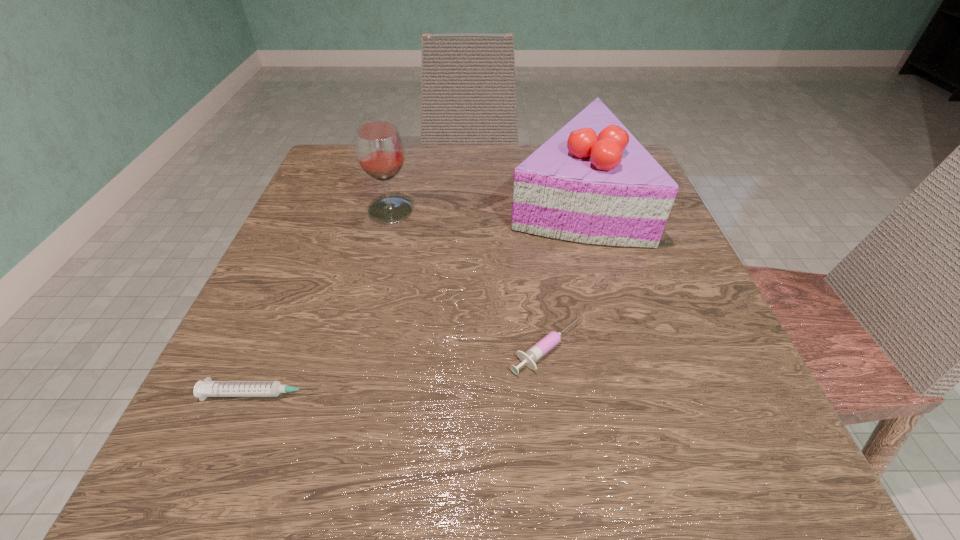
Locate an element on the screen. The width and height of the screenshot is (960, 540). cake is located at coordinates (592, 182).

At what (x,y) coordinates should I click in order to perform the action: click on wineglass. Please return your answer as a coordinate pair (x, y). Looking at the image, I should click on (379, 148).

Locate an element on the screen. the left syringe is located at coordinates (207, 388).

This screenshot has width=960, height=540. In order to click on the nearest object in this screenshot , I will do `click(207, 388)`.

Locate an element on the screen. the second nearest object is located at coordinates (528, 358).

At what (x,y) coordinates should I click in order to perform the action: click on the farther syringe. Please return your answer as a coordinate pair (x, y). Looking at the image, I should click on (528, 358).

Where is `free location located on the front of the cake`? The height and width of the screenshot is (540, 960). free location located on the front of the cake is located at coordinates (605, 326).

Find the location of a particular element. This screenshot has height=540, width=960. free spot located on the front of the wineglass is located at coordinates (363, 323).

Where is `vacant space positioned at the needle end of the left syringe`? The height and width of the screenshot is (540, 960). vacant space positioned at the needle end of the left syringe is located at coordinates (463, 394).

I want to click on free space located on the left of the right syringe, so click(x=338, y=348).